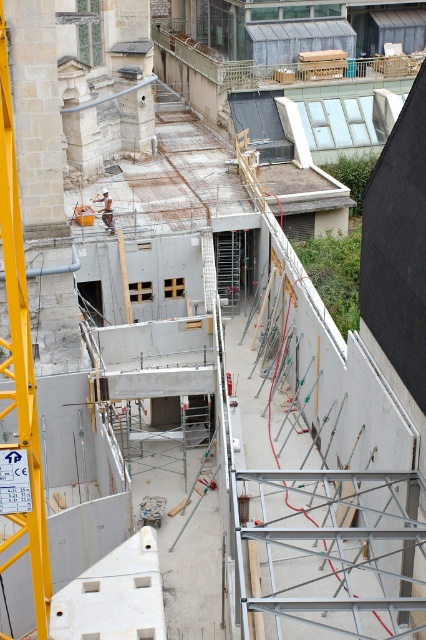
You are a delivery truck driver arriving at the construction site. You need to park your truck near the yellow metallic crane at left without blocking the light brown wooden construction worker at center. Is there enough space to park the truck next to the crane?

The yellow metallic crane at left occupies less space than the light brown wooden construction worker at center. Therefore, there might be enough space to park the truck next to the crane without blocking the construction worker, but it depends on the exact dimensions of the truck and the available area.

Consider the image. You are standing at the point labeled as point (11, 262) on a construction site map. A safety officer asks you to walk 20 feet towards the crane arm on the left side. After moving, how far will you be from the original point?

After walking 20 feet towards the crane arm on the left side from point (11, 262), you will be 20 feet away from the original point.

You are a construction supervisor planning to move a heavy beam from the yellow metallic crane at left to the light brown wooden construction worker at center. Can you safely lower the beam directly between them?

The yellow metallic crane at left is located below the light brown wooden construction worker at center, so the beam can be safely lowered directly between them without obstruction.